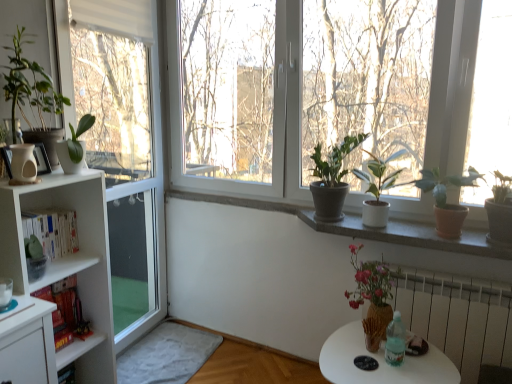
Question: Considering the relative sizes of matte brown vase with flowers at lower right and white concrete window sill at center in the image provided, is matte brown vase with flowers at lower right shorter than white concrete window sill at center?

Choices:
 (A) yes
 (B) no

Answer: (B)

Question: Is matte brown vase with flowers at lower right thinner than white concrete window sill at center?

Choices:
 (A) no
 (B) yes

Answer: (A)

Question: Is matte brown vase with flowers at lower right facing away from white concrete window sill at center?

Choices:
 (A) yes
 (B) no

Answer: (A)

Question: Is matte brown vase with flowers at lower right not close to white concrete window sill at center?

Choices:
 (A) yes
 (B) no

Answer: (B)

Question: Can you confirm if matte brown vase with flowers at lower right is wider than white concrete window sill at center?

Choices:
 (A) no
 (B) yes

Answer: (B)

Question: Is matte white vase at left to the left or to the right of green matte plant at upper right, which is the first houseplant from right to left, in the image?

Choices:
 (A) right
 (B) left

Answer: (B)

Question: In terms of width, does matte white vase at left look wider or thinner when compared to green matte plant at upper right, which is the first houseplant from right to left?

Choices:
 (A) wide
 (B) thin

Answer: (B)

Question: From their relative heights in the image, would you say matte white vase at left is taller or shorter than green matte plant at upper right, which is the first houseplant from right to left?

Choices:
 (A) short
 (B) tall

Answer: (A)

Question: From a real-world perspective, is matte white vase at left above or below green matte plant at upper right, which is the first houseplant from right to left?

Choices:
 (A) below
 (B) above

Answer: (B)

Question: Does point (59, 319) appear closer or farther from the camera than point (20, 57)?

Choices:
 (A) closer
 (B) farther

Answer: (B)

Question: Is hardcover books at left inside or outside of green matte plant at upper left, marked as the sixth houseplant in a right-to-left arrangement?

Choices:
 (A) outside
 (B) inside

Answer: (A)

Question: Considering their positions, is hardcover books at left located in front of or behind green matte plant at upper left, which appears as the first houseplant when viewed from the left?

Choices:
 (A) behind
 (B) front

Answer: (A)

Question: Based on their positions, is hardcover books at left located to the left or right of green matte plant at upper left, which appears as the first houseplant when viewed from the left?

Choices:
 (A) left
 (B) right

Answer: (A)

Question: Does point (67, 162) appear closer or farther from the camera than point (347, 150)?

Choices:
 (A) closer
 (B) farther

Answer: (A)

Question: From the image's perspective, relative to green matte plant at center, the 3th houseplant from the right, is green matte plant at left, marked as the 4th houseplant in a right-to-left arrangement, above or below?

Choices:
 (A) above
 (B) below

Answer: (A)